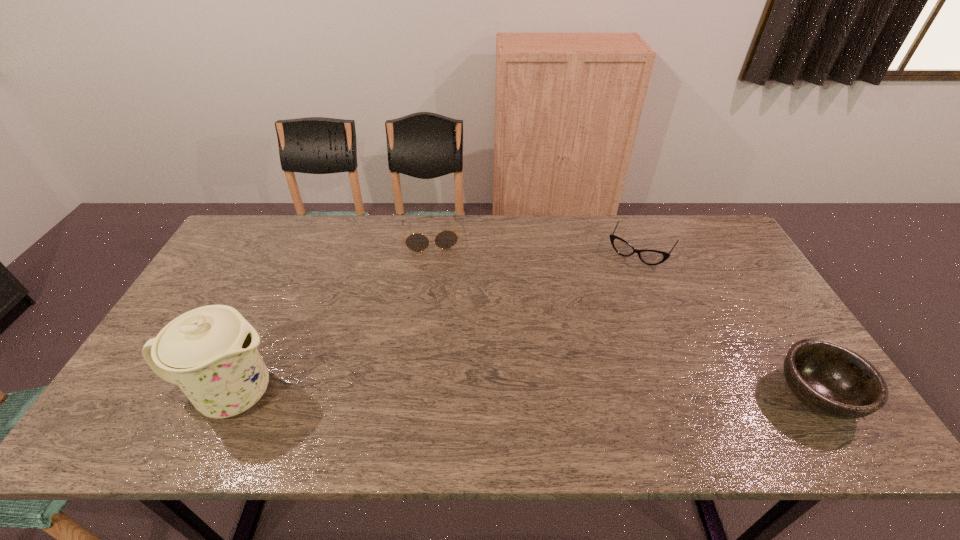
Where is `object that is at the near left corner`? Image resolution: width=960 pixels, height=540 pixels. object that is at the near left corner is located at coordinates (210, 352).

Identify the location of object that is positioned at the near right corner. (833, 380).

The width and height of the screenshot is (960, 540). In the image, there is a desktop. In order to click on vacant space at the far edge in this screenshot , I will do `click(326, 249)`.

Image resolution: width=960 pixels, height=540 pixels. I want to click on free space at the near edge, so click(x=308, y=403).

Identify the location of vacant area at the left edge of the desktop. (256, 275).

The height and width of the screenshot is (540, 960). Identify the location of free region at the right edge. (770, 343).

This screenshot has width=960, height=540. I want to click on vacant space at the far right corner, so click(x=695, y=220).

This screenshot has height=540, width=960. I want to click on free space between the tallest object and the spectacles, so click(x=435, y=323).

You are a GUI agent. You are given a task and a screenshot of the screen. Output one action in this format:
    pyautogui.click(x=<x>, y=<y>)
    Task: Click on the vacant space that's between the spectacles and the second object from left to right
    Image resolution: width=960 pixels, height=540 pixels.
    Given the screenshot: What is the action you would take?
    pyautogui.click(x=535, y=244)

This screenshot has width=960, height=540. What are the coordinates of `free point between the leftmost object and the second object from left to right` in the screenshot? It's located at (331, 315).